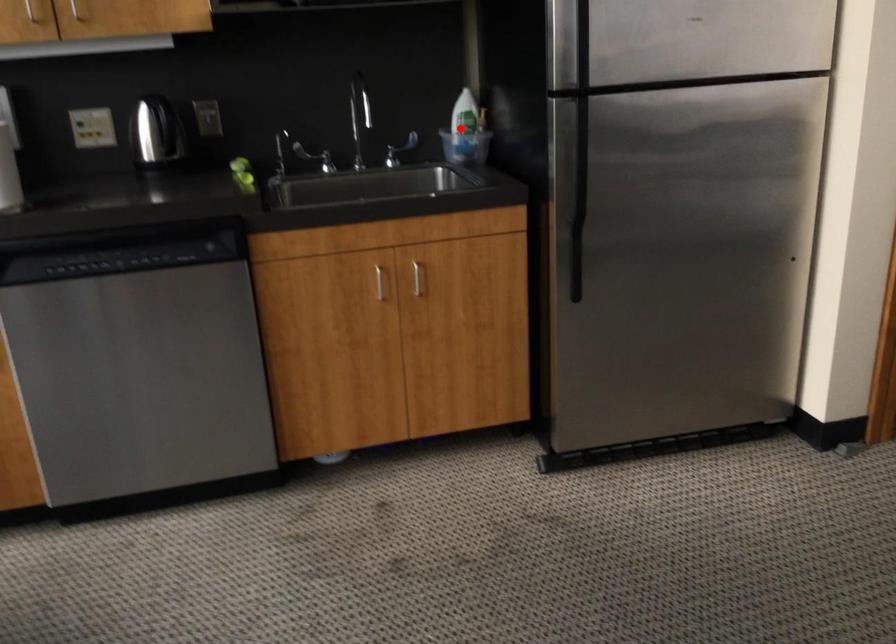
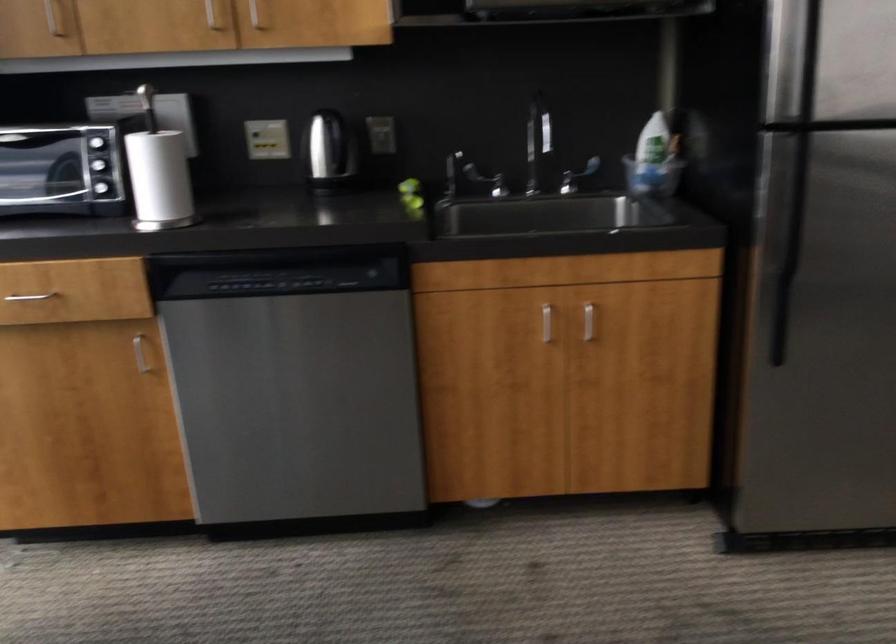
Find the pixel in the second image that matches the highlighted location in the first image.

(650, 155)